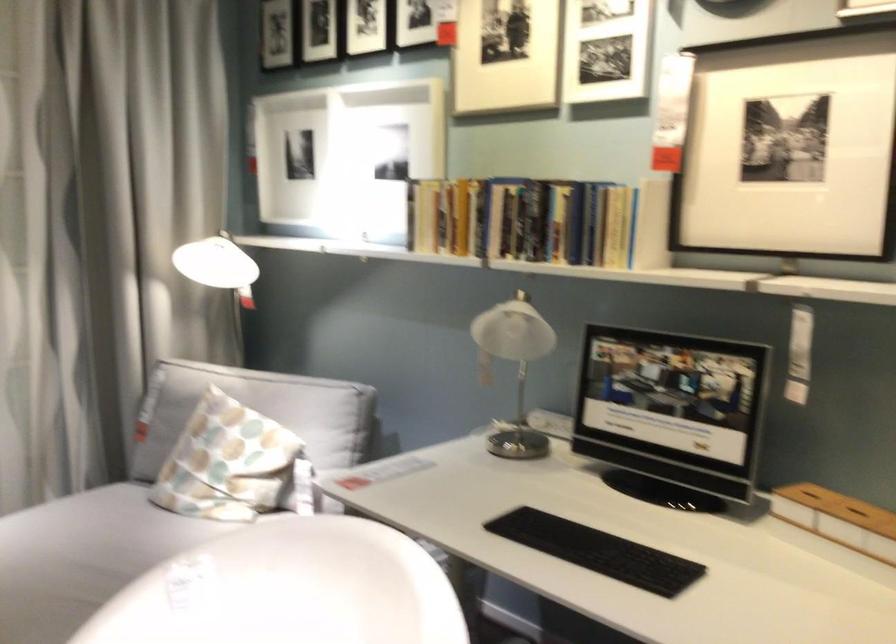
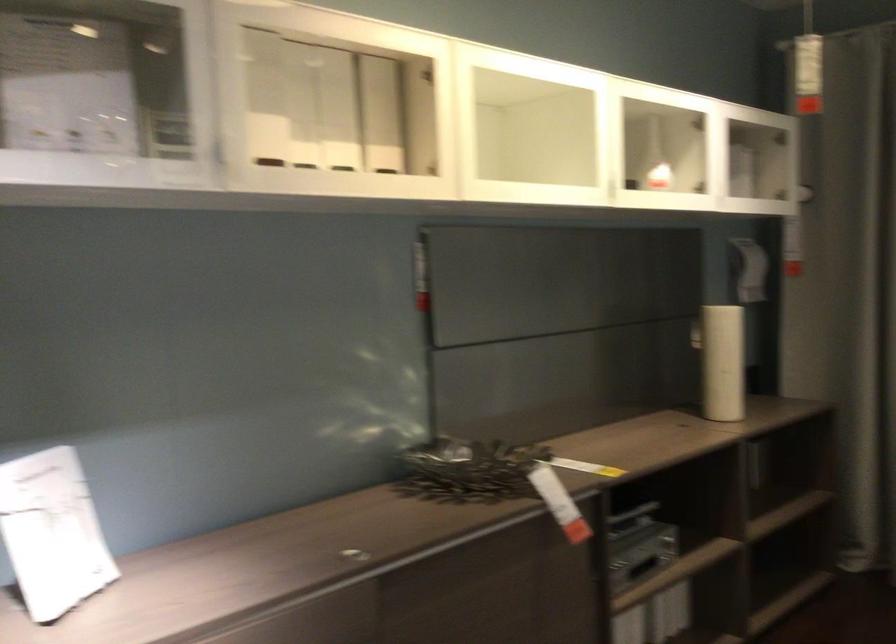
Question: The camera is either moving clockwise (left) or counter-clockwise (right) around the object. The first image is from the beginning of the video and the second image is from the end. Is the camera moving left or right when shooting the video?

Choices:
 (A) Left
 (B) Right

Answer: (B)